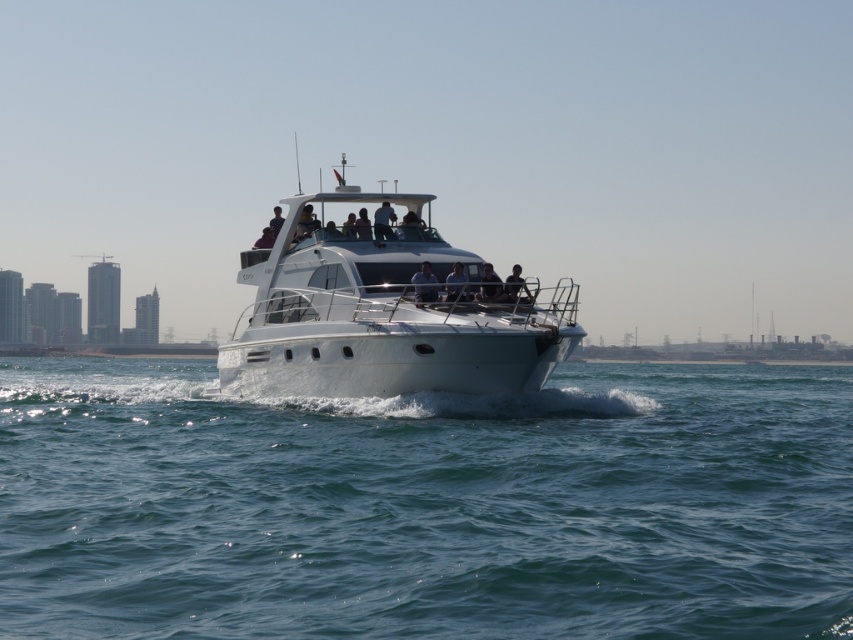
Question: Which of the following is the farthest from the observer?

Choices:
 (A) (526, 291)
 (B) (318, 330)
 (C) (454, 294)

Answer: (B)

Question: Among these objects, which one is nearest to the camera?

Choices:
 (A) clear blue water at center
 (B) dark blue fabric jacket at center
 (C) matte black shirt at center
 (D) smooth black shirt at center

Answer: (A)

Question: Where is matte blue shirt at center located in relation to dark blue fabric jacket at center in the image?

Choices:
 (A) above
 (B) below

Answer: (B)

Question: Does matte blue shirt at center appear over smooth black shirt at center?

Choices:
 (A) yes
 (B) no

Answer: (A)

Question: Does white glossy boat at center have a smaller size compared to matte blue shirt at center?

Choices:
 (A) no
 (B) yes

Answer: (A)

Question: Which of the following is the farthest from the observer?

Choices:
 (A) (518, 264)
 (B) (492, 300)
 (C) (392, 232)
 (D) (418, 289)

Answer: (C)